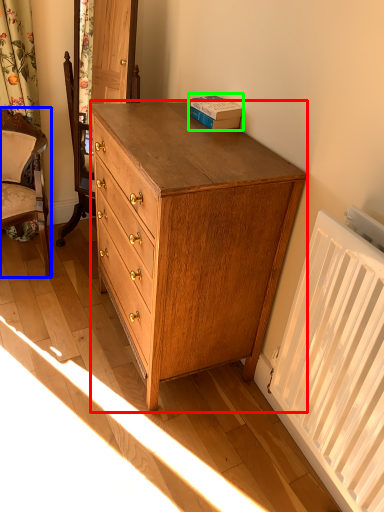
Question: Estimate the real-world distances between objects in this image. Which object is farther from chest of drawers (highlighted by a red box), chair (highlighted by a blue box) or book (highlighted by a green box)?

Choices:
 (A) chair
 (B) book

Answer: (A)